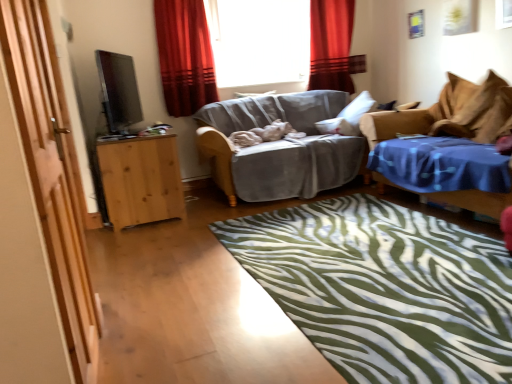
You are a GUI agent. You are given a task and a screenshot of the screen. Output one action in this format:
    pyautogui.click(x=<x>, y=<y>)
    Task: Click on the unoccupied space behind wooden door at left
    The height and width of the screenshot is (384, 512).
    Given the screenshot: What is the action you would take?
    pyautogui.click(x=153, y=324)